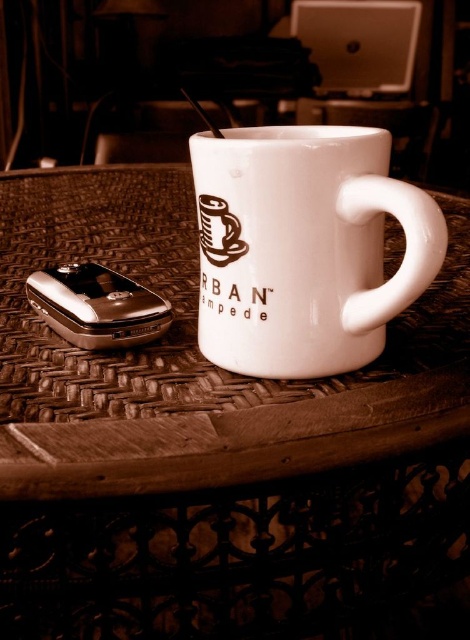
You are trying to place a small decorative item on the white wicker table at center. Given that the table is at coordinates point 0.561, 0.415, can you confirm its position relative to the other objects in the scene?

The white wicker table at center is located at point (195,358), which means it is positioned centrally within the scene as described.